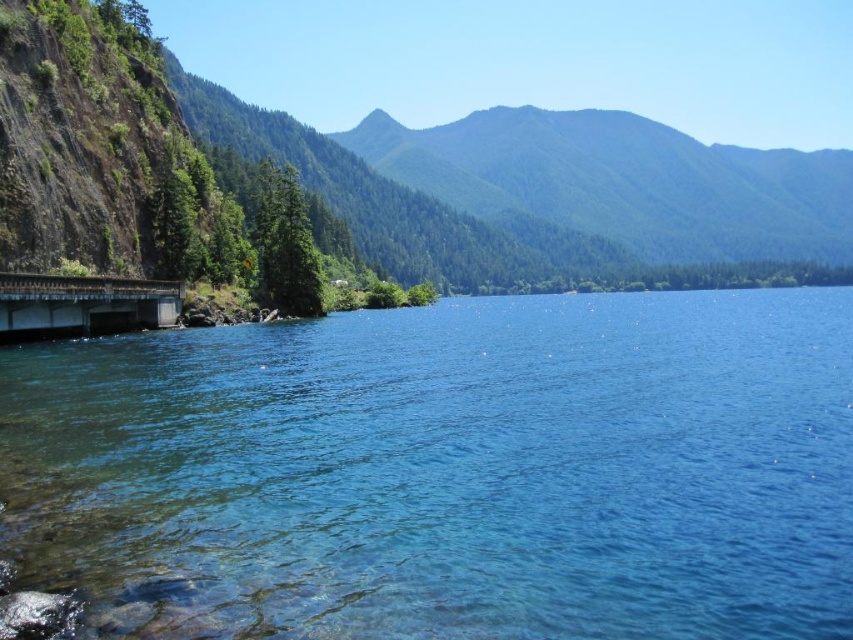
Question: Which object is closer to the camera taking this photo?

Choices:
 (A) clear blue water at lower left
 (B) rusty metal bridge at lower left
 (C) green forested mountain at upper center

Answer: (A)

Question: Is clear blue water at lower left behind rusty metal bridge at lower left?

Choices:
 (A) no
 (B) yes

Answer: (A)

Question: Based on their relative distances, which object is farther from the clear blue water at lower left?

Choices:
 (A) rusty metal bridge at lower left
 (B) green forested mountain at upper center

Answer: (B)

Question: Among these objects, which one is nearest to the camera?

Choices:
 (A) rusty metal bridge at lower left
 (B) clear blue water at lower left

Answer: (B)

Question: Is green forested mountain at upper center bigger than rusty metal bridge at lower left?

Choices:
 (A) no
 (B) yes

Answer: (B)

Question: Can you confirm if clear blue water at lower left is positioned below green forested mountain at upper center?

Choices:
 (A) no
 (B) yes

Answer: (B)